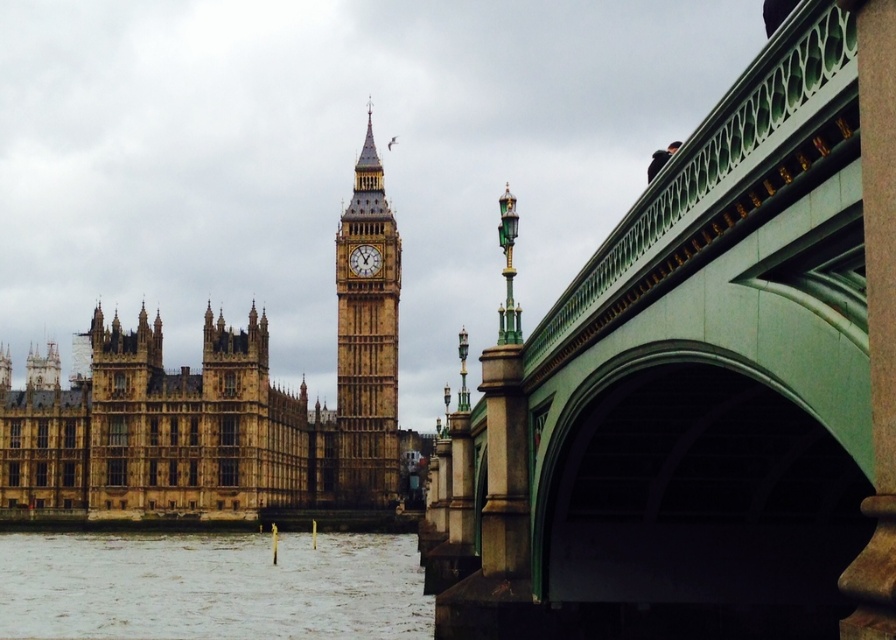
Question: Which point is farther to the camera?

Choices:
 (A) (371, 264)
 (B) (389, 381)
 (C) (200, 586)

Answer: (A)

Question: Which point appears closest to the camera in this image?

Choices:
 (A) (274, 412)
 (B) (356, 349)
 (C) (373, 262)

Answer: (A)

Question: Estimate the real-world distances between objects in this image. Which object is closer to the brown stone building at center?

Choices:
 (A) green stone bridge at upper right
 (B) brown stone building at left
 (C) brown stone clock tower at center

Answer: (B)

Question: In this image, where is brown stone building at center located relative to golden stone clock at center?

Choices:
 (A) left
 (B) right

Answer: (A)

Question: Is green stone bridge at upper right below brown stone building at left?

Choices:
 (A) yes
 (B) no

Answer: (B)

Question: Does brown stone building at center appear under brown stone building at left?

Choices:
 (A) yes
 (B) no

Answer: (B)